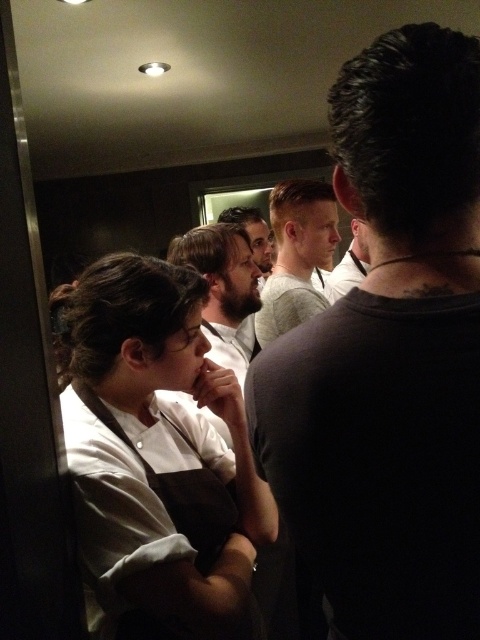
Who is shorter, light brown hair at center or matte black shirt at center?

matte black shirt at center is shorter.

Does light brown hair at center appear on the right side of matte black shirt at center?

No, light brown hair at center is not to the right of matte black shirt at center.

From the picture: Who is more distant from viewer, [302,211] or [367,260]?

Positioned behind is point [367,260].

Where is `light brown hair at center`? This screenshot has width=480, height=640. light brown hair at center is located at coordinates (297, 253).

Does dark gray shirt at right have a larger size compared to white matte chef coat at left?

Actually, dark gray shirt at right might be smaller than white matte chef coat at left.

Can you confirm if dark gray shirt at right is smaller than white matte chef coat at left?

Yes, dark gray shirt at right is smaller than white matte chef coat at left.

Does point (396, 76) come farther from viewer compared to point (207, 547)?

No, it is not.

Where is `dark gray shirt at right`? The width and height of the screenshot is (480, 640). dark gray shirt at right is located at coordinates (391, 355).

Can you confirm if dark gray shirt at right is smaller than matte black shirt at center?

No, dark gray shirt at right is not smaller than matte black shirt at center.

Between dark gray shirt at right and matte black shirt at center, which one is positioned higher?

Positioned higher is matte black shirt at center.

Measure the distance between point (332,472) and camera.

Point (332,472) and camera are 55.22 centimeters apart.

At what (x,y) coordinates should I click in order to perform the action: click on dark gray shirt at right. Please return your answer as a coordinate pair (x, y). Looking at the image, I should click on (391, 355).